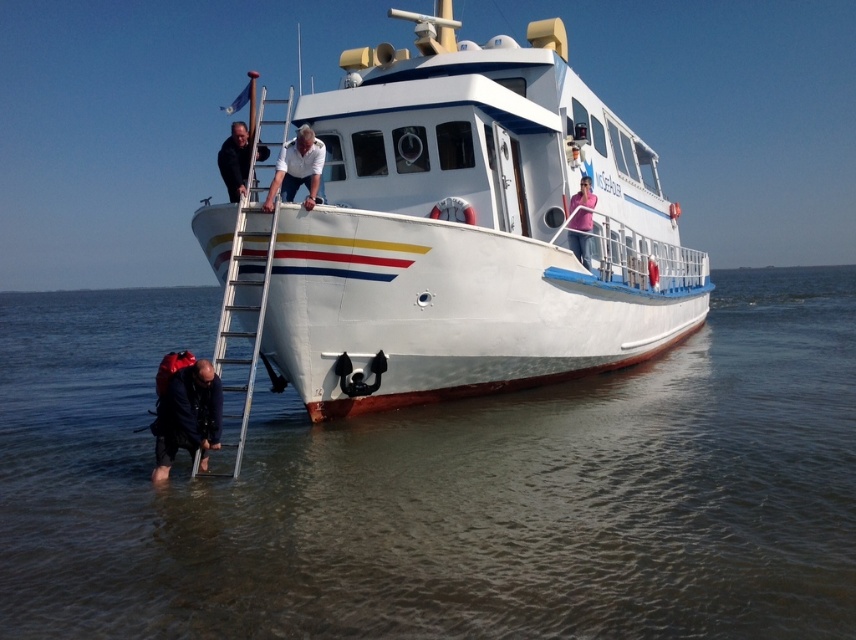
You are a visitor who wants to board the boat. You see the silver metallic ladder at center and the dark blue backpack at lower left. Which object is higher in the image?

The silver metallic ladder at center is above the dark blue backpack at lower left, so the silver metallic ladder at center is higher.

You are standing on a dock and want to board the white glossy boat at center. The boat is currently 8.61 meters away from you. If your maximum reach is 2 meters, can you grab onto the boat without swimming?

The white glossy boat at center is 8.61 meters away from you, which is farther than your maximum reach of 2 meters. You cannot grab onto the boat without swimming.

From the picture: You are a lifeguard on duty and see the clear water at lower left and the ladder extending from the water up to the deck. How far apart are these two points?

The clear water at lower left and the ladder extending from the water up to the deck are 4.75 meters apart.